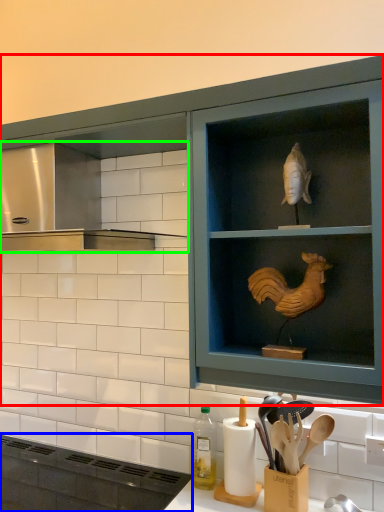
Question: Considering the real-world distances, which object is farthest from cabinetry (highlighted by a red box)? appliance (highlighted by a blue box) or vent (highlighted by a green box)?

Choices:
 (A) appliance
 (B) vent

Answer: (B)